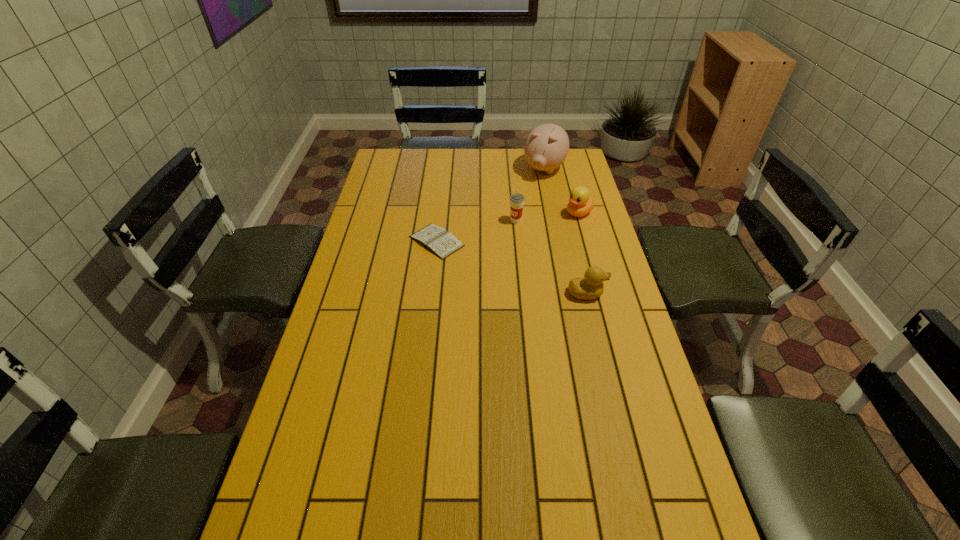
At what (x,y) coordinates should I click in order to perform the action: click on unoccupied area between the second object from left to right and the farthest object. Please return your answer as a coordinate pair (x, y). The image size is (960, 540). Looking at the image, I should click on (530, 195).

Identify the location of vacant area that lies between the nearer duckling and the fourth shortest object. The width and height of the screenshot is (960, 540). (551, 258).

You are a GUI agent. You are given a task and a screenshot of the screen. Output one action in this format:
    pyautogui.click(x=<x>, y=<y>)
    Task: Click on the blank region between the cup and the diary
    The width and height of the screenshot is (960, 540).
    Given the screenshot: What is the action you would take?
    [x=476, y=231]

Find the location of a particular element. vacant space in between the shortest object and the nearest object is located at coordinates (512, 267).

Image resolution: width=960 pixels, height=540 pixels. I want to click on vacant area between the shortest object and the nearest object, so click(512, 267).

Identify the location of vacant point located between the shortest object and the second tallest object. (476, 231).

Locate which object ranks second in proximity to the nearer duckling. Please provide its 2D coordinates. Your answer should be formatted as a tuple, i.e. [(x, y)], where the tuple contains the x and y coordinates of a point satisfying the conditions above.

[(580, 203)]

Locate which object is the closest to the nearest object. Please provide its 2D coordinates. Your answer should be formatted as a tuple, i.e. [(x, y)], where the tuple contains the x and y coordinates of a point satisfying the conditions above.

[(516, 200)]

Locate an element on the screen. This screenshot has width=960, height=540. vacant region that satisfies the following two spatial constraints: 1. on the front side of the tallest object; 2. on the face of the nearest object is located at coordinates (569, 293).

Identify the location of vacant region that satisfies the following two spatial constraints: 1. on the back side of the farther duckling; 2. on the right side of the second tallest object. (515, 213).